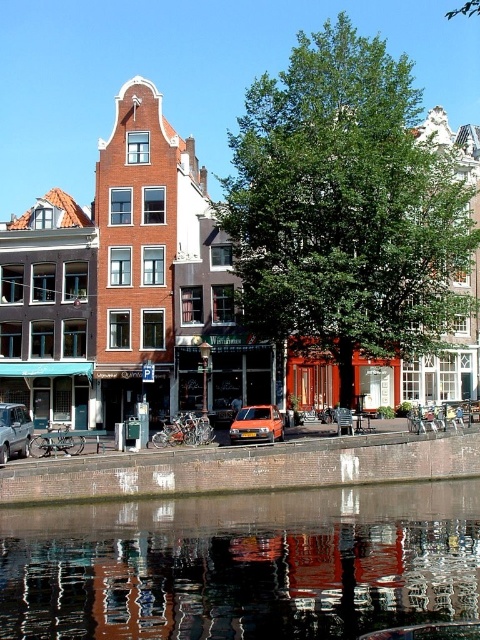
Question: Which point is farther to the camera?

Choices:
 (A) smooth reflective water at center
 (B) silver metallic car at lower left
 (C) orange matte car at center

Answer: (C)

Question: Considering the real-world distances, which object is farthest from the smooth reflective water at center?

Choices:
 (A) orange matte car at center
 (B) silver metallic car at lower left

Answer: (B)

Question: Can you confirm if smooth reflective water at center is positioned above orange matte car at center?

Choices:
 (A) yes
 (B) no

Answer: (B)

Question: Is smooth reflective water at center closer to camera compared to orange matte car at center?

Choices:
 (A) no
 (B) yes

Answer: (B)

Question: Can you confirm if smooth reflective water at center is positioned above orange matte car at center?

Choices:
 (A) yes
 (B) no

Answer: (B)

Question: Which of the following is the closest to the observer?

Choices:
 (A) orange matte car at center
 (B) smooth reflective water at center

Answer: (B)